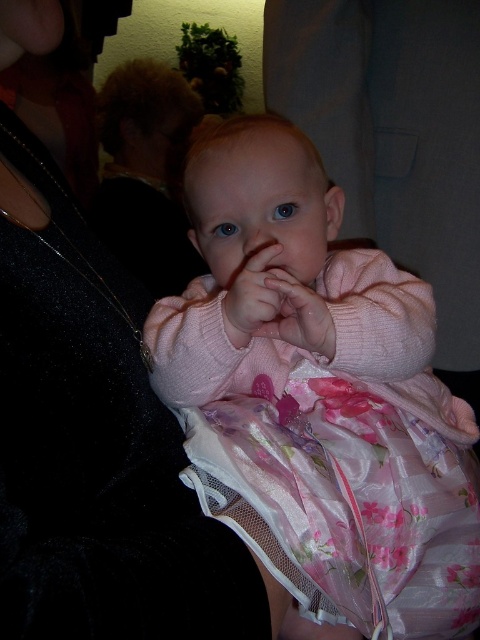
Looking at this image, you are a photographer setting up for a baby photoshoot. You have a matte black dress at upper left and a pink soft fabric hand at center in your frame. Which object should you focus on if you want to capture the larger one?

The matte black dress at upper left is bigger than the pink soft fabric hand at center, so you should focus on the matte black dress at upper left to capture the larger one.

You are a photographer trying to capture a closeup shot of the baby. You are currently positioned so that the blonde hair at upper left and the pink soft fabric hand at center are both in your viewfinder. Can you move closer to the baby to get a better shot without moving the people in the background? Explain your reasoning.

The distance between the blonde hair at upper left and the pink soft fabric hand at center is 4.67 feet. Since this distance is part of the baby, moving closer would require adjusting your position while keeping both features in frame. However, the people in the background are partially visible and might block your path. If they remain stationary, you could move closer as long as you don

You are a photographer adjusting your camera settings. You need to focus on the blonde hair at upper left and the pink soft fabric hand at center. Which object should you focus on first to ensure proper depth of field?

You should focus on the blonde hair at upper left first because it is closer to the viewer than the pink soft fabric hand at center, allowing for better depth of field adjustment.